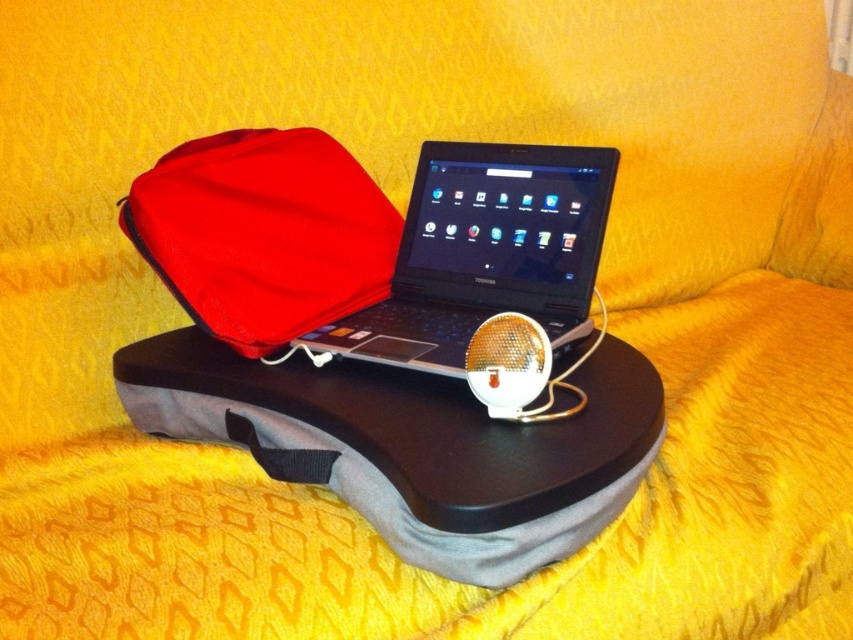
Who is positioned more to the left, red fabric laptop case at center or black plastic laptop at center?

From the viewer's perspective, red fabric laptop case at center appears more on the left side.

Is red fabric laptop case at center shorter than black plastic laptop at center?

Incorrect, red fabric laptop case at center's height does not fall short of black plastic laptop at center's.

Which is in front, point (363, 276) or point (550, 182)?

Point (550, 182)

Where is `red fabric laptop case at center`? The height and width of the screenshot is (640, 853). red fabric laptop case at center is located at coordinates (263, 234).